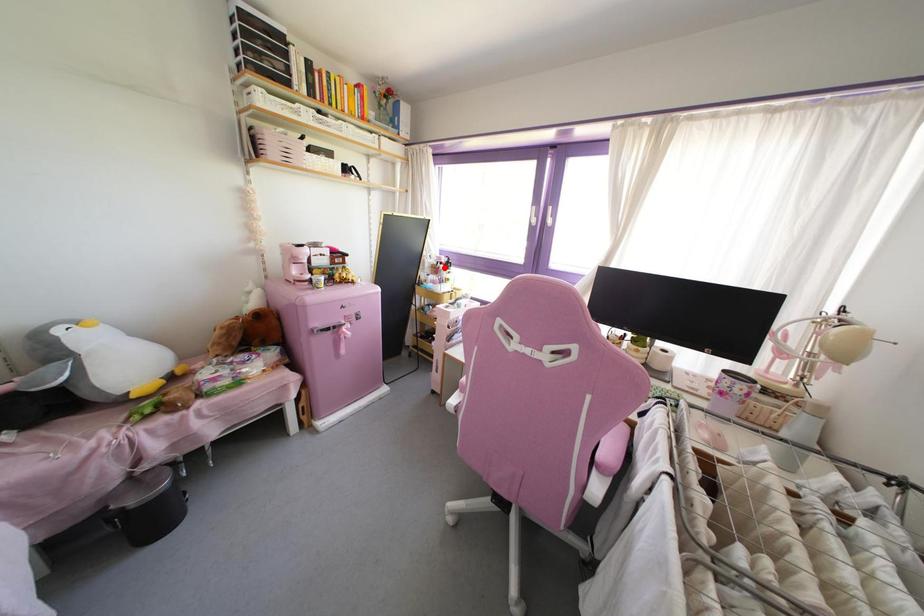
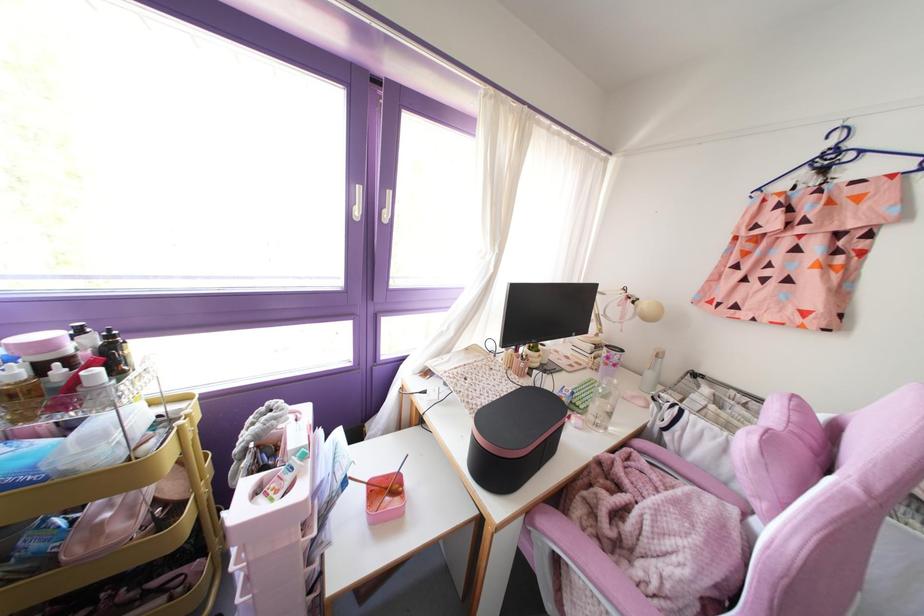
Question: I am providing you with two images of the same scene from different viewpoints. Image1 has a red point marked. In image2, the corresponding 3D location appears at what relative position? Reply with the corresponding letter.

Choices:
 (A) Closer
 (B) Farther

Answer: (B)